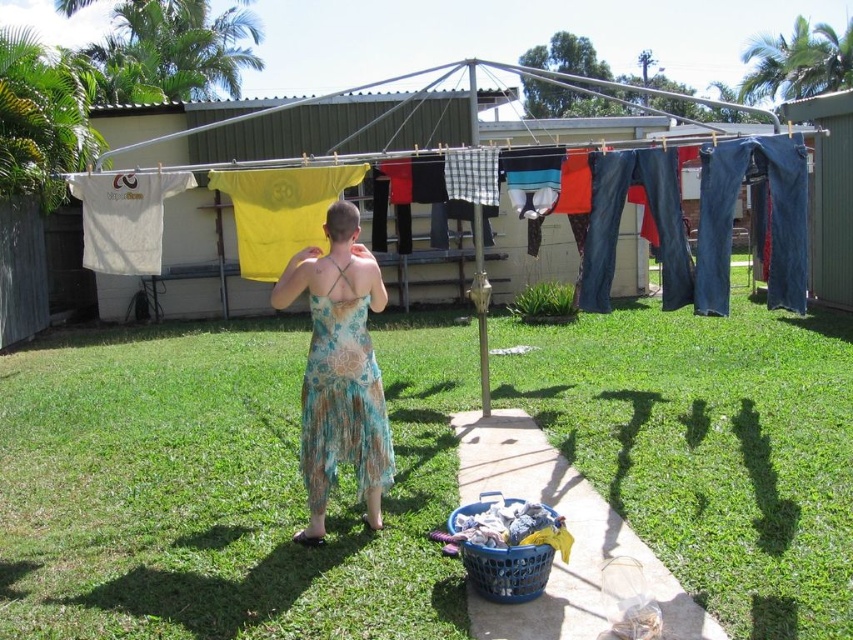
Is point (509, 176) behind point (521, 582)?

That is True.

This screenshot has width=853, height=640. Identify the location of denim jeans at upper center. (647, 209).

At what (x,y) coordinates should I click in order to perform the action: click on denim jeans at upper center. Please return your answer as a coordinate pair (x, y). The height and width of the screenshot is (640, 853). Looking at the image, I should click on (647, 209).

Where is `green grass at lower left`? Image resolution: width=853 pixels, height=640 pixels. green grass at lower left is located at coordinates (218, 486).

What do you see at coordinates (218, 486) in the screenshot? The width and height of the screenshot is (853, 640). I see `green grass at lower left` at bounding box center [218, 486].

The width and height of the screenshot is (853, 640). What are the coordinates of `green grass at lower left` in the screenshot? It's located at (218, 486).

Can you confirm if blue plastic laundry basket at lower center is bigger than blue plastic basket at lower center?

Indeed, blue plastic laundry basket at lower center has a larger size compared to blue plastic basket at lower center.

Locate an element on the screen. blue plastic laundry basket at lower center is located at coordinates (508, 570).